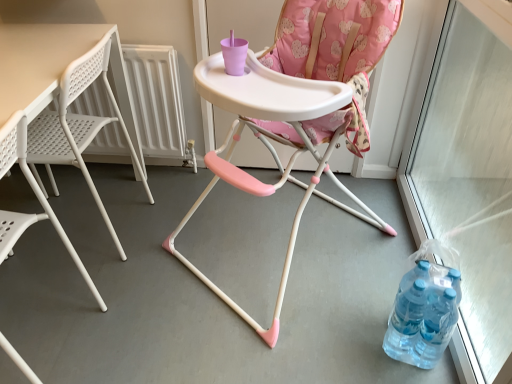
Identify the location of free location in front of white plastic radiator at left. (123, 220).